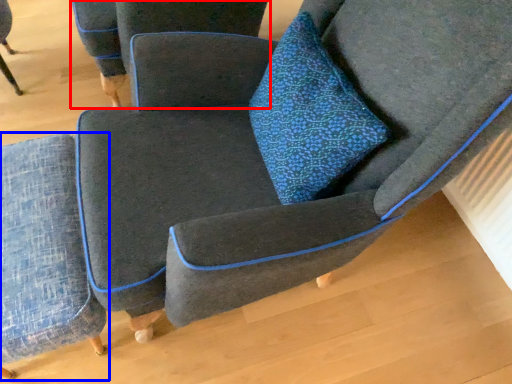
Question: Which object is further to the camera taking this photo, chair (highlighted by a red box) or chair (highlighted by a blue box)?

Choices:
 (A) chair
 (B) chair

Answer: (A)